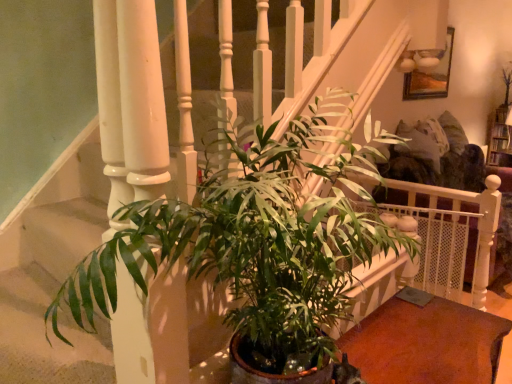
Find the location of `free spot above smooth brown table at lower right (from a real-world perspective)`. free spot above smooth brown table at lower right (from a real-world perspective) is located at coordinates (429, 334).